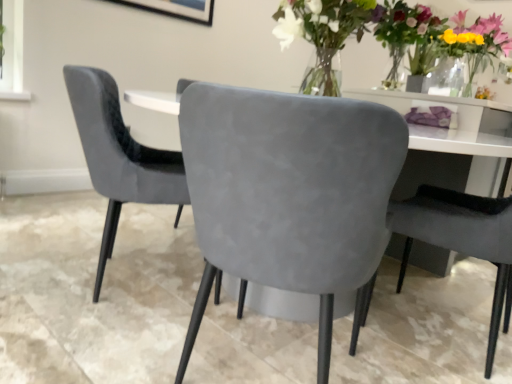
Identify the location of blank area beneath suede gray chair at center, which appears as the second chair when viewed from the right (from a real-world perspective). (254, 358).